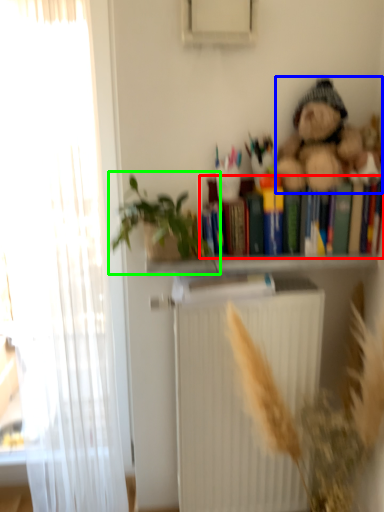
Question: Which object is the farthest from book (highlighted by a red box)? Choose among these: teddy bear (highlighted by a blue box) or houseplant (highlighted by a green box).

Choices:
 (A) teddy bear
 (B) houseplant

Answer: (B)